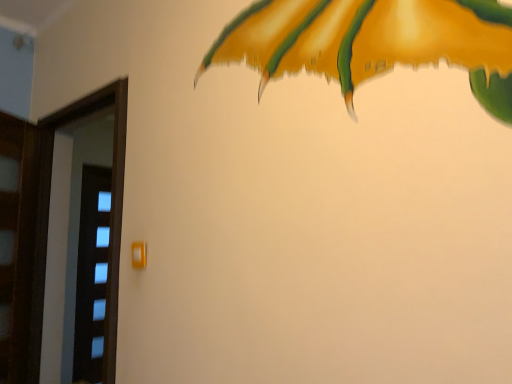
Question: From a real-world perspective, does matte orange door handle at center stand above transparent glass screen door at left?

Choices:
 (A) no
 (B) yes

Answer: (B)

Question: Would you say matte orange door handle at center is a long distance from transparent glass screen door at left?

Choices:
 (A) yes
 (B) no

Answer: (B)

Question: Can you confirm if matte orange door handle at center is wider than transparent glass screen door at left?

Choices:
 (A) no
 (B) yes

Answer: (A)

Question: Does matte orange door handle at center contain transparent glass screen door at left?

Choices:
 (A) no
 (B) yes

Answer: (A)

Question: Does matte orange door handle at center have a smaller size compared to transparent glass screen door at left?

Choices:
 (A) no
 (B) yes

Answer: (B)

Question: Is matte orange door handle at center closer to camera compared to transparent glass screen door at left?

Choices:
 (A) yes
 (B) no

Answer: (A)

Question: Considering the relative sizes of transparent glass screen door at left and matte orange door handle at center in the image provided, is transparent glass screen door at left smaller than matte orange door handle at center?

Choices:
 (A) no
 (B) yes

Answer: (A)

Question: Is transparent glass screen door at left looking in the opposite direction of matte orange door handle at center?

Choices:
 (A) no
 (B) yes

Answer: (A)

Question: Is transparent glass screen door at left positioned behind matte orange door handle at center?

Choices:
 (A) yes
 (B) no

Answer: (A)

Question: Considering the relative sizes of transparent glass screen door at left and matte orange door handle at center in the image provided, is transparent glass screen door at left wider than matte orange door handle at center?

Choices:
 (A) yes
 (B) no

Answer: (A)

Question: Is transparent glass screen door at left to the left of matte orange door handle at center from the viewer's perspective?

Choices:
 (A) no
 (B) yes

Answer: (B)

Question: Considering the relative sizes of transparent glass screen door at left and matte orange door handle at center in the image provided, is transparent glass screen door at left bigger than matte orange door handle at center?

Choices:
 (A) yes
 (B) no

Answer: (A)

Question: Is point (99, 92) positioned closer to the camera than point (142, 261)?

Choices:
 (A) closer
 (B) farther

Answer: (B)